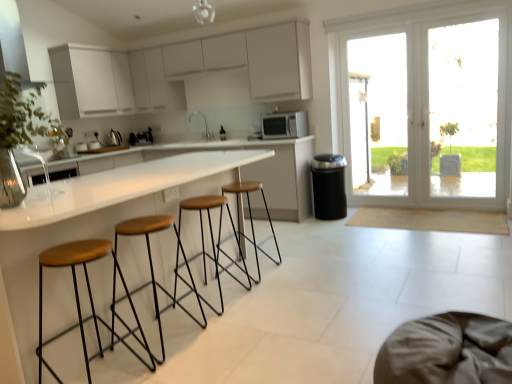
Where is `free location to the right of brown leather stool at lower left, the first stool when ordered from front to back`? free location to the right of brown leather stool at lower left, the first stool when ordered from front to back is located at coordinates (188, 364).